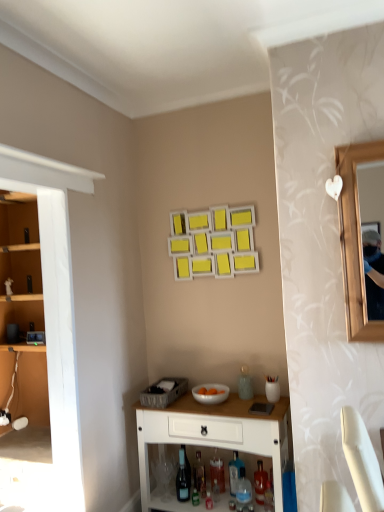
Question: Is translucent glass bottle at lower center, placed as the 6th bottle when sorted from right to left, placed right next to translucent glass wine bottle at lower center?

Choices:
 (A) yes
 (B) no

Answer: (A)

Question: Does translucent glass bottle at lower center, the first bottle viewed from the left, have a lesser width compared to translucent glass wine bottle at lower center?

Choices:
 (A) no
 (B) yes

Answer: (A)

Question: From a real-world perspective, is translucent glass bottle at lower center, the first bottle viewed from the left, over translucent glass wine bottle at lower center?

Choices:
 (A) yes
 (B) no

Answer: (B)

Question: Can you confirm if translucent glass bottle at lower center, placed as the 6th bottle when sorted from right to left, is smaller than translucent glass wine bottle at lower center?

Choices:
 (A) no
 (B) yes

Answer: (B)

Question: Can you confirm if translucent glass bottle at lower center, placed as the 6th bottle when sorted from right to left, is taller than translucent glass wine bottle at lower center?

Choices:
 (A) no
 (B) yes

Answer: (A)

Question: Based on their positions, is translucent glass bottle at lower center, the 4th bottle in the left-to-right sequence, located to the left or right of translucent glass bottle at center, the third bottle when ordered from left to right?

Choices:
 (A) right
 (B) left

Answer: (A)

Question: Is point (238, 458) closer or farther from the camera than point (211, 462)?

Choices:
 (A) farther
 (B) closer

Answer: (A)

Question: In terms of width, does translucent glass bottle at lower center, the third bottle positioned from the right, look wider or thinner when compared to translucent glass bottle at center, the third bottle when ordered from left to right?

Choices:
 (A) wide
 (B) thin

Answer: (A)

Question: From a real-world perspective, is translucent glass bottle at lower center, the third bottle positioned from the right, above or below translucent glass bottle at center, the 4th bottle viewed from the right?

Choices:
 (A) above
 (B) below

Answer: (B)

Question: Looking at their shapes, would you say translucent glass bottle at lower center, placed as the 6th bottle when sorted from right to left, is wider or thinner than white glossy bowl at lower center?

Choices:
 (A) wide
 (B) thin

Answer: (B)

Question: Relative to white glossy bowl at lower center, is translucent glass bottle at lower center, placed as the 6th bottle when sorted from right to left, in front or behind?

Choices:
 (A) behind
 (B) front

Answer: (A)

Question: Is translucent glass bottle at lower center, placed as the 6th bottle when sorted from right to left, taller or shorter than white glossy bowl at lower center?

Choices:
 (A) tall
 (B) short

Answer: (A)

Question: Is translucent glass bottle at lower center, the first bottle viewed from the left, bigger or smaller than white glossy bowl at lower center?

Choices:
 (A) small
 (B) big

Answer: (A)

Question: From a real-world perspective, is translucent glass bottle at lower center, placed as the 6th bottle when sorted from right to left, above or below translucent glass wine bottle at lower center?

Choices:
 (A) above
 (B) below

Answer: (B)

Question: Considering the relative positions of translucent glass bottle at lower center, placed as the 6th bottle when sorted from right to left, and translucent glass wine bottle at lower center in the image provided, is translucent glass bottle at lower center, placed as the 6th bottle when sorted from right to left, to the left or to the right of translucent glass wine bottle at lower center?

Choices:
 (A) right
 (B) left

Answer: (A)